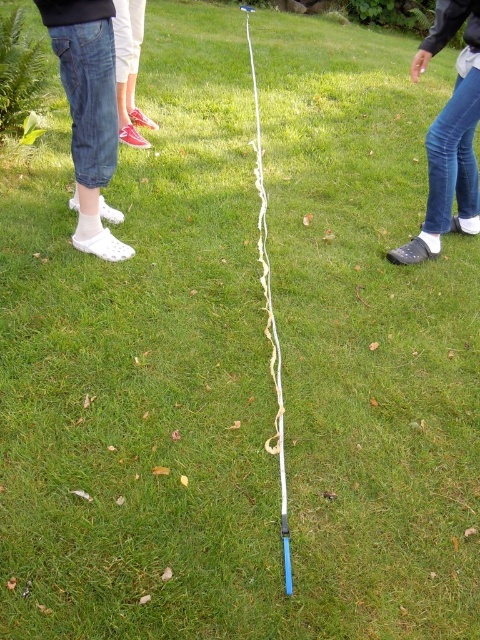
Based on the photo, you are a photographer setting up a shot of the scene. You need to ensure that the blue denim jeans at lower right and the white fabric string at center are both visible in the frame. Given their heights, which object might require adjusting the camera angle to include its full height?

The blue denim jeans at lower right has a greater height compared to the white fabric string at center, so the blue denim jeans at lower right might require adjusting the camera angle to include its full height.

You are a photographer setting up a photo shoot in the described grassy area. You need to place two props, the white fabric socks at left and the blue denim jeans at lower right, such that they are both visible in the frame. Given their sizes, which prop should you position closer to the camera to ensure both appear equally sized in the final photo?

Since the white fabric socks at left is smaller than the blue denim jeans at lower right, you should position the white fabric socks at left closer to the camera to make them appear the same size in the photo.

You are a photographer setting up a shot of the scene. You need to focus on the blue denim jeans at lower right and the white fabric string at center. Which object should you adjust your camera focus on first if you want to ensure both are in focus, considering their sizes?

The blue denim jeans at lower right is larger in size than the white fabric string at center, so you should focus on the blue denim jeans at lower right first to ensure both are in focus.